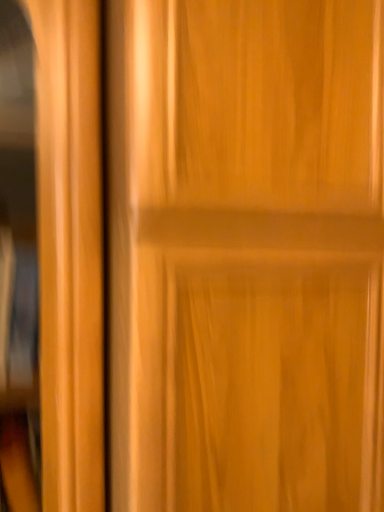
In the scene shown: What is the approximate width of wooden door at center?

wooden door at center is 22.25 inches wide.

What do you see at coordinates (246, 254) in the screenshot? The height and width of the screenshot is (512, 384). I see `wooden door at center` at bounding box center [246, 254].

This screenshot has height=512, width=384. In order to click on wooden door at center in this screenshot , I will do `click(246, 254)`.

Measure the distance between wooden door at center and camera.

A distance of 17.51 inches exists between wooden door at center and camera.

You are a GUI agent. You are given a task and a screenshot of the screen. Output one action in this format:
    pyautogui.click(x=<x>, y=<y>)
    Task: Click on the wooden door at center
    Image resolution: width=384 pixels, height=512 pixels.
    Given the screenshot: What is the action you would take?
    pyautogui.click(x=246, y=254)